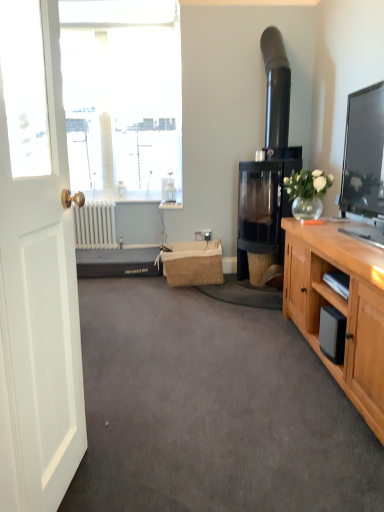
Question: In terms of height, does gray carpet at center look taller or shorter compared to white matte door at left?

Choices:
 (A) tall
 (B) short

Answer: (B)

Question: Considering the positions of gray carpet at center and white matte door at left in the image, is gray carpet at center bigger or smaller than white matte door at left?

Choices:
 (A) big
 (B) small

Answer: (A)

Question: Based on their relative distances, which object is farther from the white matte radiator at lower left?

Choices:
 (A) black glass fireplace at center-right
 (B) gray carpet at center
 (C) white matte door at left
 (D) translucent glass vase at upper right
 (E) burlap picnic basket at center

Answer: (C)

Question: Considering the real-world distances, which object is closest to the translucent glass vase at upper right?

Choices:
 (A) burlap picnic basket at center
 (B) white matte radiator at lower left
 (C) white matte door at left
 (D) black glass fireplace at center-right
 (E) gray carpet at center

Answer: (D)